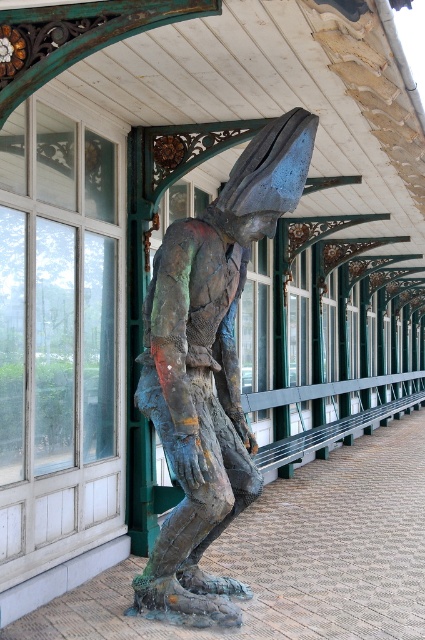
Question: Which point is farther to the camera?

Choices:
 (A) bronze statue at center
 (B) bronze textured figure at center

Answer: (B)

Question: Does bronze textured figure at center lie behind bronze statue at center?

Choices:
 (A) yes
 (B) no

Answer: (A)

Question: Does bronze textured figure at center appear under bronze statue at center?

Choices:
 (A) yes
 (B) no

Answer: (B)

Question: Among these points, which one is nearest to the camera?

Choices:
 (A) (292, 572)
 (B) (173, 554)

Answer: (B)

Question: Can you confirm if bronze textured figure at center is positioned below bronze statue at center?

Choices:
 (A) no
 (B) yes

Answer: (A)